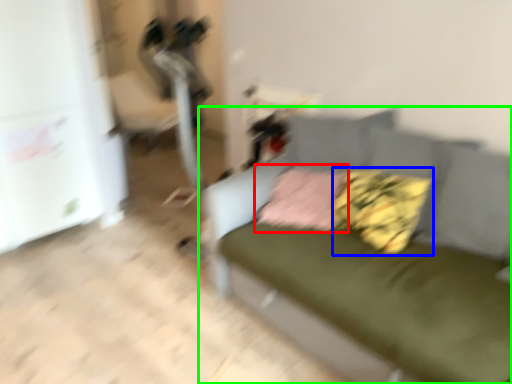
Question: Which is nearer to the pillow (highlighted by a red box)? pillow (highlighted by a blue box) or studio couch (highlighted by a green box).

Choices:
 (A) pillow
 (B) studio couch

Answer: (A)